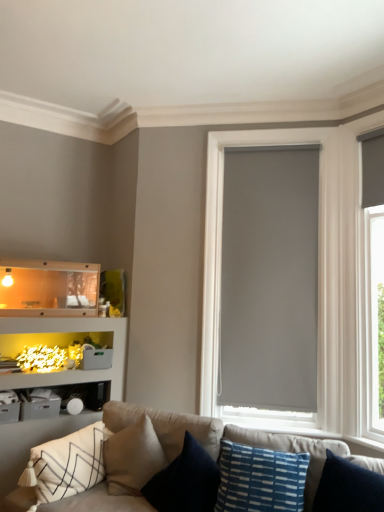
Question: Would you say soft beige fabric couch at lower center is to the left or to the right of translucent plastic shelf at lower left in the picture?

Choices:
 (A) left
 (B) right

Answer: (B)

Question: From the image's perspective, is soft beige fabric couch at lower center located above or below translucent plastic shelf at lower left?

Choices:
 (A) below
 (B) above

Answer: (A)

Question: Which object is positioned closest to the white textured pillow at lower left, which is counted as the first pillow, starting from the left?

Choices:
 (A) matte gray roller shade at center
 (B) soft beige fabric couch at lower center
 (C) blue textured pillow at lower center, which is the third pillow in left-to-right order
 (D) dark blue textured pillow at center, positioned as the 2th pillow in left-to-right order
 (E) translucent plastic shelf at lower left

Answer: (B)

Question: Which object is positioned farthest from the soft beige fabric couch at lower center?

Choices:
 (A) blue textured pillow at lower center, which ranks as the 1th pillow in right-to-left order
 (B) translucent plastic shelf at lower left
 (C) white textured pillow at lower left, positioned as the 3th pillow in right-to-left order
 (D) matte gray roller shade at center
 (E) dark blue textured pillow at center, which is counted as the second pillow, starting from the right

Answer: (B)